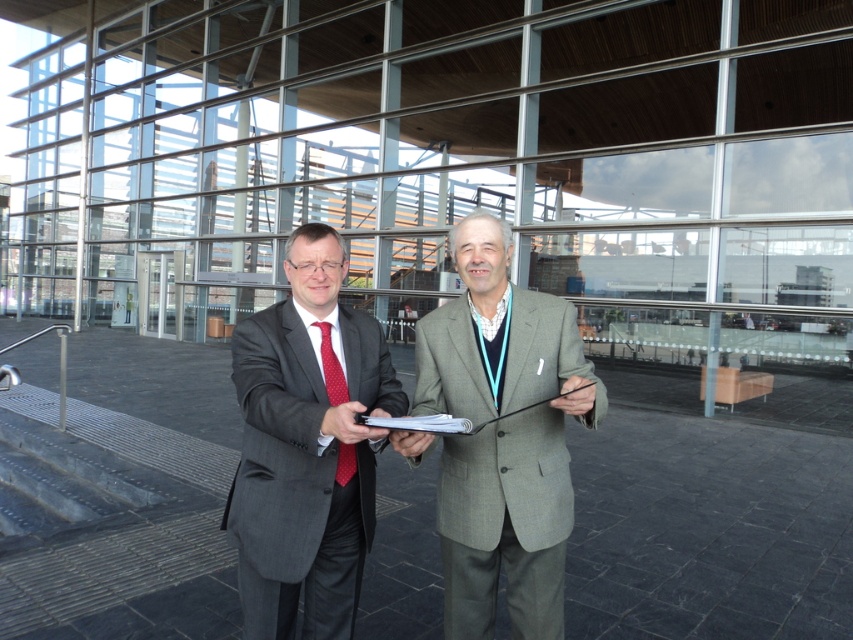
Between gray wool suit at center and matte gray suit at center, which one is positioned higher?

Positioned higher is gray wool suit at center.

The width and height of the screenshot is (853, 640). Describe the element at coordinates (502, 436) in the screenshot. I see `gray wool suit at center` at that location.

Identify the location of gray wool suit at center. (502, 436).

Can you confirm if gray wool suit at center is bigger than red dotted tie at center?

Indeed, gray wool suit at center has a larger size compared to red dotted tie at center.

Does gray wool suit at center have a lesser height compared to red dotted tie at center?

No, gray wool suit at center is not shorter than red dotted tie at center.

In the scene shown: Measure the distance between point (543, 586) and camera.

Point (543, 586) and camera are 6.59 feet apart.

Where is `gray wool suit at center`? This screenshot has height=640, width=853. gray wool suit at center is located at coordinates (502, 436).

Can you confirm if matte gray suit at center is smaller than red dotted tie at center?

No, matte gray suit at center is not smaller than red dotted tie at center.

Between matte gray suit at center and red dotted tie at center, which one is positioned higher?

red dotted tie at center

Between point (309, 406) and point (317, 323), which one is positioned in front?

Point (309, 406) is in front.

Locate an element on the screen. matte gray suit at center is located at coordinates (306, 445).